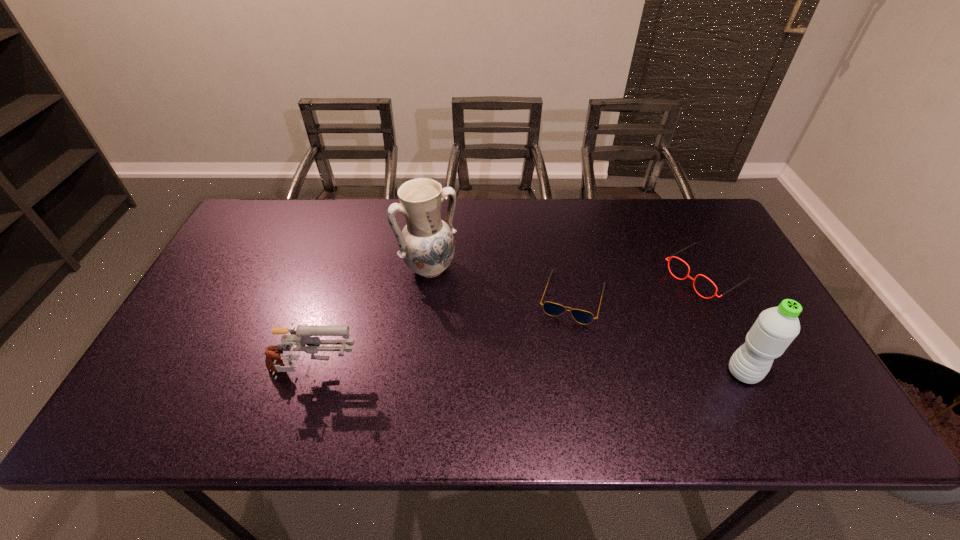
Find the location of `vacant space on the desktop that is between the third shortest object and the second tallest object and is positioned on either side of the second object from left to right`. vacant space on the desktop that is between the third shortest object and the second tallest object and is positioned on either side of the second object from left to right is located at coordinates (516, 374).

Locate an element on the screen. free spot on the desktop that is between the leftmost object and the water bottle and is positioned on the front-facing side of the spectacles is located at coordinates (540, 374).

Identify the location of free space on the desktop that is between the third shortest object and the water bottle and is positioned on the front-facing side of the shortest object. (551, 374).